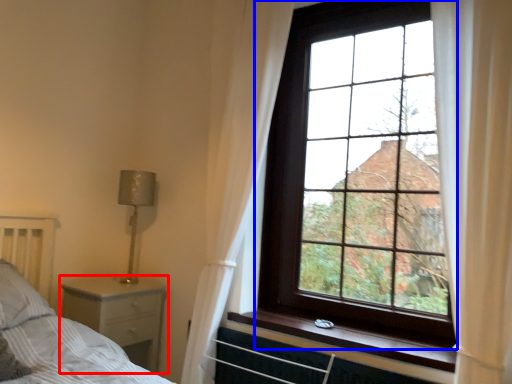
Question: Among these objects, which one is farthest to the camera, nightstand (highlighted by a red box) or window (highlighted by a blue box)?

Choices:
 (A) nightstand
 (B) window

Answer: (A)